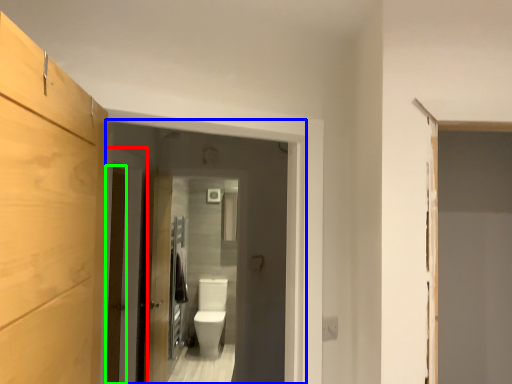
Question: Which object is positioned farthest from door (highlighted by a red box)? Select from screen door (highlighted by a blue box) and barn door (highlighted by a green box).

Choices:
 (A) screen door
 (B) barn door

Answer: (A)